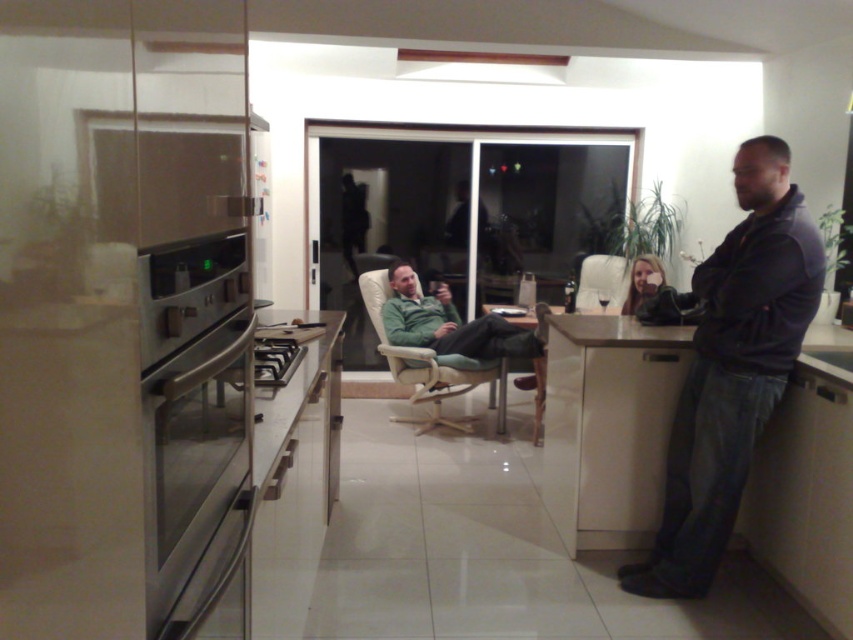
You are standing at the entrance of the kitchen and want to reach the stainless steel oven at left. What is the 2D coordinate of the oven?

The 2D coordinate of the stainless steel oven at left is at point (194, 419).

In the scene shown: You are standing at point (611, 260) and want to walk to the dining table. Is the point (793, 320) in your path?

Yes, the point (793, 320) is in your path because it is in front of point (611, 260) where you are standing.

You are a guest in this room and want to place your dark blue leather jacket at right on the white leather armchair at center. Is the jacket currently positioned in a way that would make it easy to reach from the chair?

The dark blue leather jacket at right is located below the white leather armchair at center, so it is positioned in a way that would make it easy to reach from the chair.